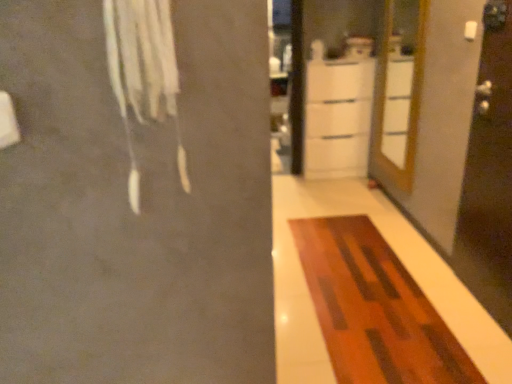
Question: Should I look upward or downward to see wooden at right?

Choices:
 (A) up
 (B) down

Answer: (A)

Question: From a real-world perspective, is white glossy cabinet at center physically below wooden rug at center?

Choices:
 (A) yes
 (B) no

Answer: (B)

Question: Is the position of white glossy cabinet at center less distant than that of wooden rug at center?

Choices:
 (A) yes
 (B) no

Answer: (B)

Question: Is white glossy cabinet at center positioned beyond the bounds of wooden rug at center?

Choices:
 (A) no
 (B) yes

Answer: (B)

Question: Is white glossy cabinet at center to the right of wooden rug at center from the viewer's perspective?

Choices:
 (A) no
 (B) yes

Answer: (B)

Question: Would you say wooden rug at center is part of white glossy cabinet at center's contents?

Choices:
 (A) yes
 (B) no

Answer: (B)

Question: Does white glossy cabinet at center come behind wooden rug at center?

Choices:
 (A) no
 (B) yes

Answer: (B)

Question: Is transparent glass screen door at right beside white glossy cabinet at center?

Choices:
 (A) no
 (B) yes

Answer: (A)

Question: Does transparent glass screen door at right have a larger size compared to white glossy cabinet at center?

Choices:
 (A) yes
 (B) no

Answer: (B)

Question: Considering the relative sizes of transparent glass screen door at right and white glossy cabinet at center in the image provided, is transparent glass screen door at right thinner than white glossy cabinet at center?

Choices:
 (A) yes
 (B) no

Answer: (A)

Question: From a real-world perspective, is transparent glass screen door at right on top of white glossy cabinet at center?

Choices:
 (A) no
 (B) yes

Answer: (B)

Question: Can you confirm if transparent glass screen door at right is taller than white glossy cabinet at center?

Choices:
 (A) no
 (B) yes

Answer: (B)

Question: Is transparent glass screen door at right positioned beyond the bounds of white glossy cabinet at center?

Choices:
 (A) yes
 (B) no

Answer: (A)

Question: Is wooden at right far away from white fabric at upper left?

Choices:
 (A) no
 (B) yes

Answer: (B)